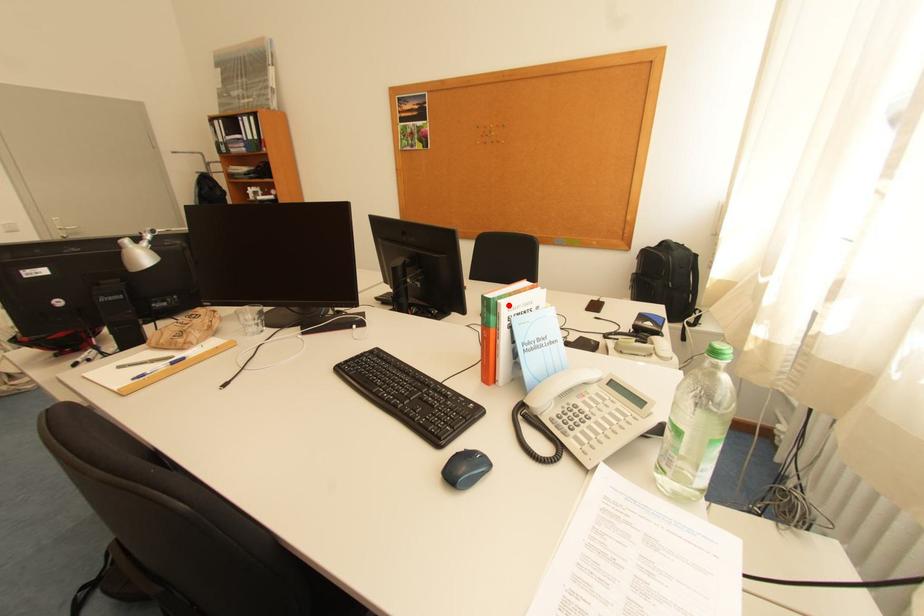
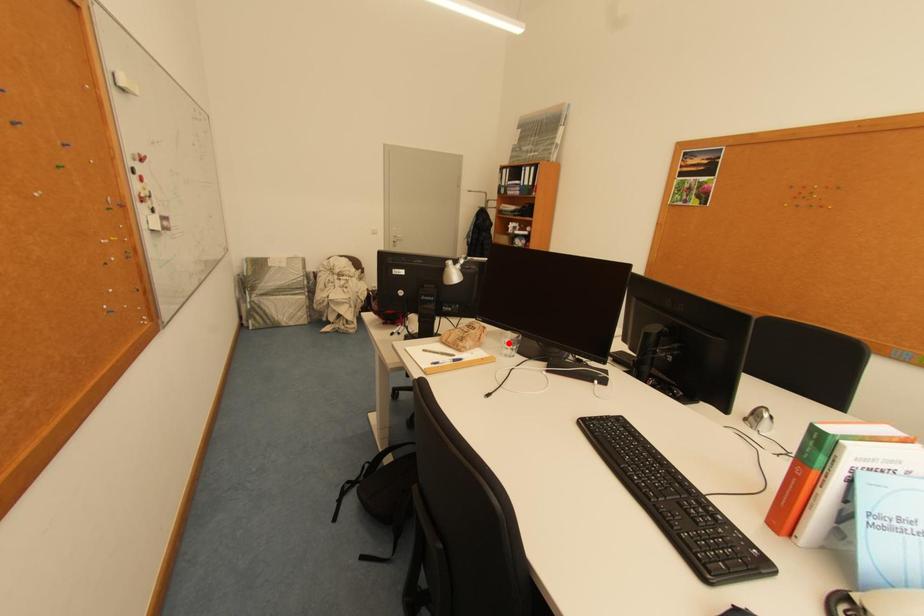
I am providing you with two images of the same scene from different viewpoints. A red point is marked on the first image and another point is marked on the second image. Do the highlighted points in image1 and image2 indicate the same real-world spot?

No